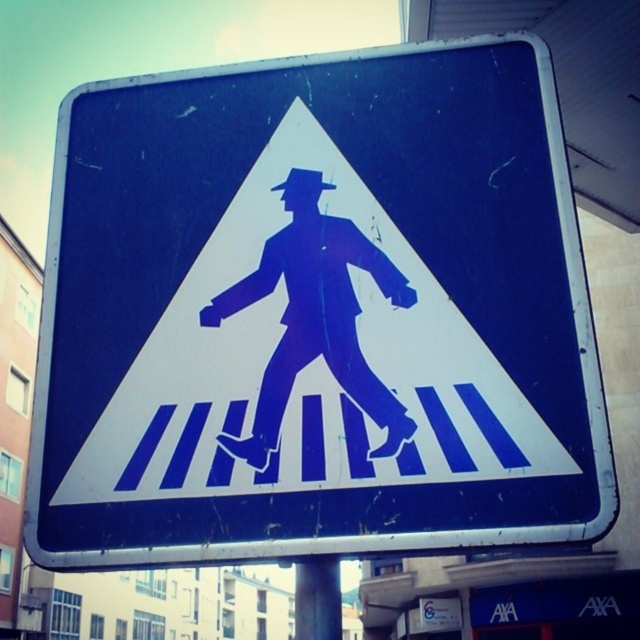
You are a delivery person trying to secure a package on the metallic gray pole at lower center. The package is the same size as the blue matte pedestrian at center. Will the package fit on the pole?

The blue matte pedestrian at center occupies less space than the metallic gray pole at lower center, so the package will fit on the pole since it is smaller than the pole.

You are standing in front of a pedestrian crossing sign. There is a specific point at coordinates point (296, 172) on the sign. If you want to touch this point with a stick that is 1.5 meters long, can you reach it without moving closer?

The distance between point (296, 172) and the viewer is 1.24 meters. Since the stick is 1.5 meters long, which is longer than the distance, you can reach the point without moving closer.

You are a delivery robot approaching the blue matte pedestrian at center and the metallic gray pole at lower center. Which object is closer to you as you move forward?

The blue matte pedestrian at center is closer to you because it is in front of the metallic gray pole at lower center.